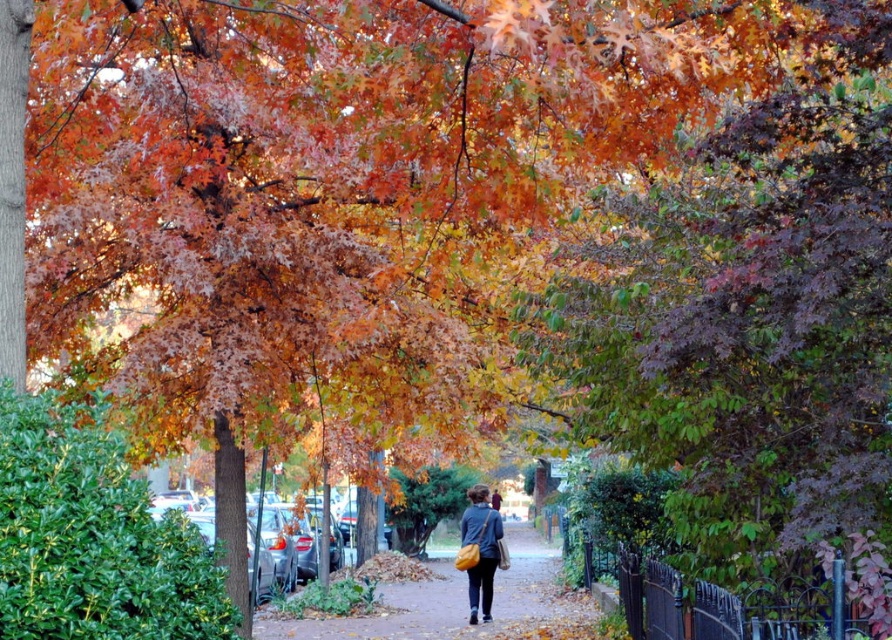
Question: Which point is closer to the camera?

Choices:
 (A) brown textured sidewalk at center
 (B) matte yellow bag at center

Answer: (A)

Question: Among these points, which one is farthest from the camera?

Choices:
 (A) (558, 566)
 (B) (482, 515)

Answer: (A)

Question: Is brown textured sidewalk at center further to the viewer compared to matte yellow bag at center?

Choices:
 (A) no
 (B) yes

Answer: (A)

Question: Is brown textured sidewalk at center above matte yellow bag at center?

Choices:
 (A) no
 (B) yes

Answer: (A)

Question: Which point is farther to the camera?

Choices:
 (A) (488, 531)
 (B) (514, 525)

Answer: (B)

Question: Does brown textured sidewalk at center appear over matte yellow bag at center?

Choices:
 (A) no
 (B) yes

Answer: (A)